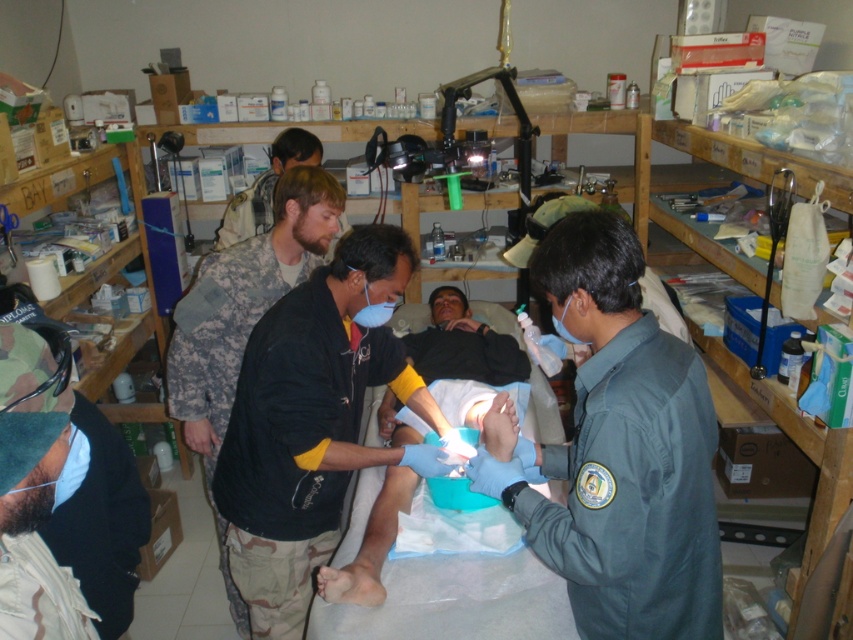
Which is above, green uniform at center or camouflage uniform at center?

green uniform at center is higher up.

Is point (672, 566) closer to camera compared to point (190, 337)?

That is True.

Who is more forward, (640, 536) or (254, 294)?

Point (640, 536) is in front.

The height and width of the screenshot is (640, 853). What are the coordinates of `green uniform at center` in the screenshot? It's located at (619, 451).

Is point (236, 401) farther from viewer compared to point (209, 406)?

That is False.

Which of these two, black matte shirt at center or camouflage uniform at center, stands shorter?

black matte shirt at center is shorter.

Is point (366, 230) closer to viewer compared to point (291, 176)?

Yes.

Image resolution: width=853 pixels, height=640 pixels. Find the location of `black matte shirt at center`. black matte shirt at center is located at coordinates tap(312, 422).

Does green uniform at center have a greater height compared to black matte shirt at center?

Incorrect, green uniform at center's height is not larger of black matte shirt at center's.

Where is `green uniform at center`? This screenshot has height=640, width=853. green uniform at center is located at coordinates (619, 451).

Locate an element on the screen. The height and width of the screenshot is (640, 853). green uniform at center is located at coordinates (619, 451).